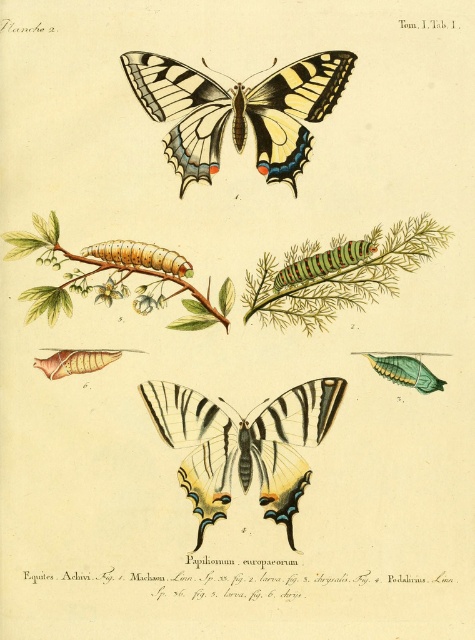
Can you confirm if green feathery stem at center is shorter than multicolored fuzzy caterpillar at center?

No.

Describe the element at coordinates (339, 273) in the screenshot. I see `green feathery stem at center` at that location.

The height and width of the screenshot is (640, 475). I want to click on green feathery stem at center, so click(339, 273).

From the picture: Is matte black butterfly at upper center below matte black butterfly at center?

No.

Is point (297, 97) positioned behind point (165, 413)?

No, (297, 97) is in front of (165, 413).

Which is in front, point (169, 116) or point (190, 400)?

Point (169, 116) is more forward.

Where is `matte black butterfly at upper center`? The height and width of the screenshot is (640, 475). matte black butterfly at upper center is located at coordinates (238, 109).

Is matte black butterfly at upper center taller than multicolored fuzzy caterpillar at center?

Correct, matte black butterfly at upper center is much taller as multicolored fuzzy caterpillar at center.

Is matte black butterfly at upper center shorter than multicolored fuzzy caterpillar at center?

No, matte black butterfly at upper center is not shorter than multicolored fuzzy caterpillar at center.

Which is in front, point (195, 90) or point (275, 284)?

Positioned in front is point (195, 90).

Locate an element on the screen. Image resolution: width=475 pixels, height=640 pixels. matte black butterfly at upper center is located at coordinates (238, 109).